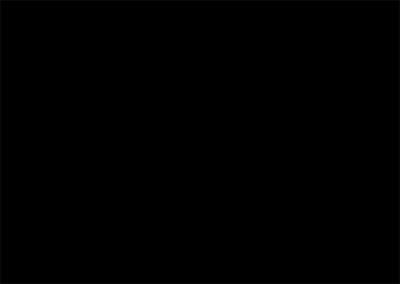
Where is `wire that connects to computer`? The width and height of the screenshot is (400, 284). wire that connects to computer is located at coordinates (28, 227), (12, 257).